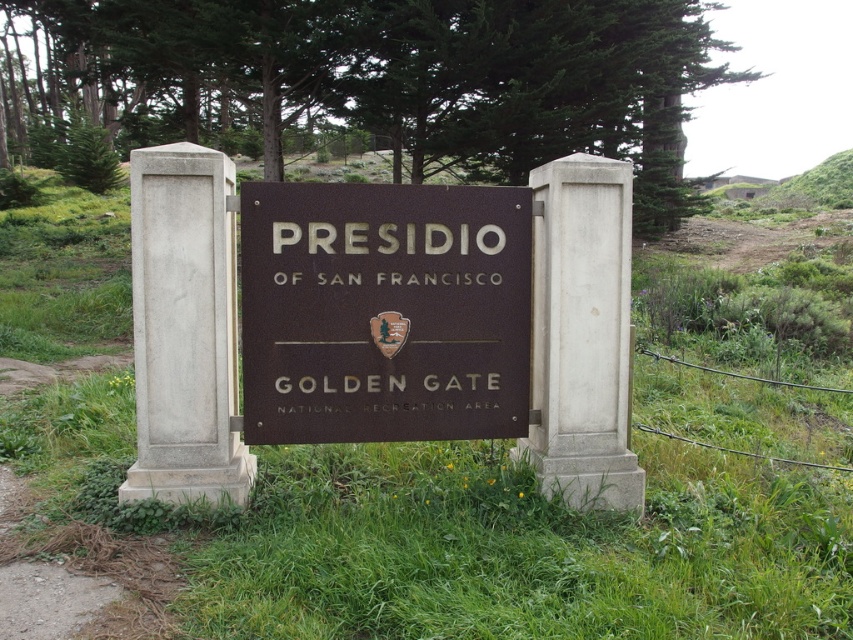
You are standing at the entrance marked by the signboard between the two stone pillars. You notice two points in the image labeled as point (354, 262) and point (630, 333). Which point is closer to you from your current position?

Point (354, 262) is in front of point (630, 333), so it is closer to your current position.